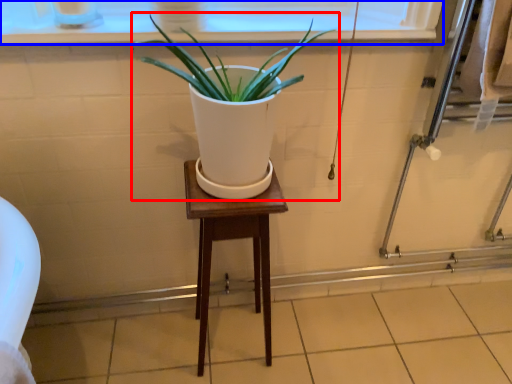
Question: Which of the following is the closest to the observer, houseplant (highlighted by a red box) or window frame (highlighted by a blue box)?

Choices:
 (A) houseplant
 (B) window frame

Answer: (A)